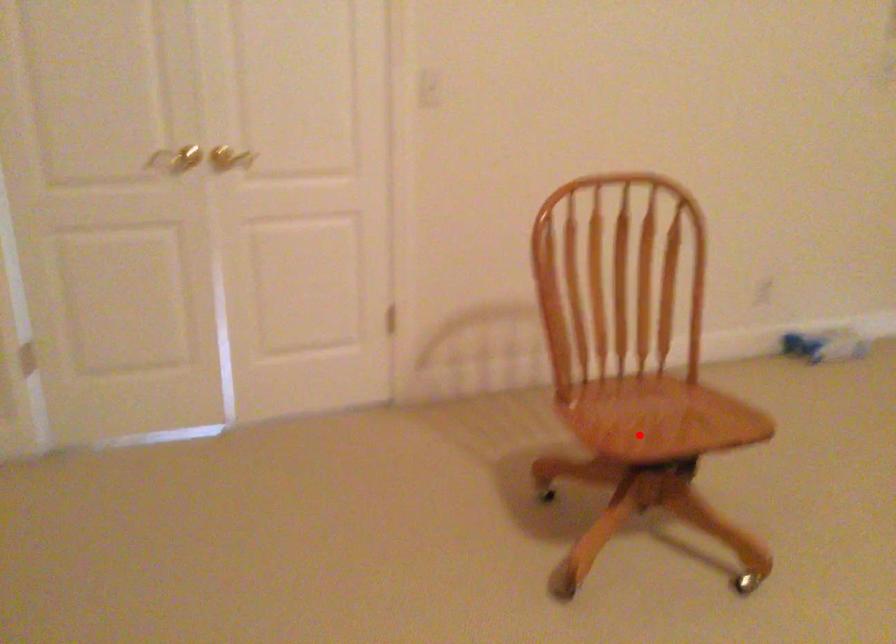
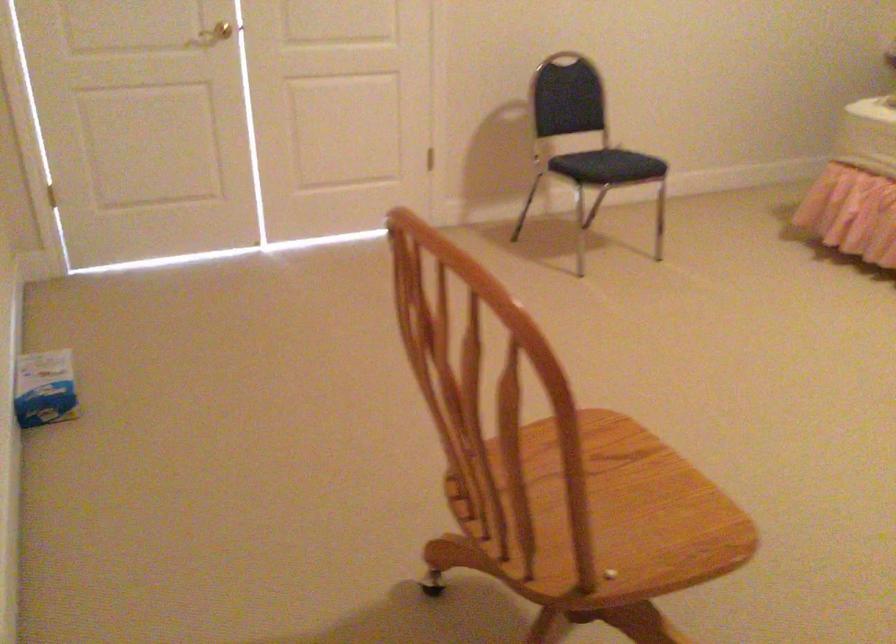
Question: I am providing you with two images of the same scene from different viewpoints. In image1, a red point is highlighted. Considering the same 3D point in image2, which of the following is correct?

Choices:
 (A) It is closer
 (B) It is farther

Answer: (A)